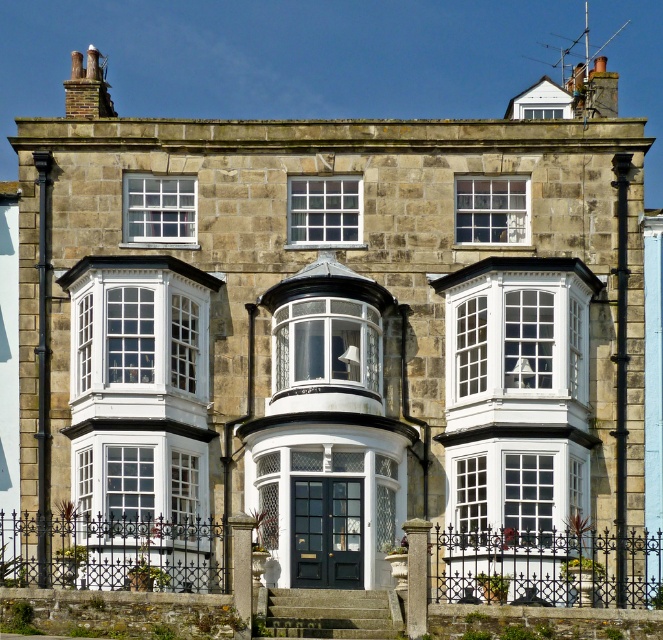
Which is below, clear glass bay window at center or clear glass window at upper center?

Positioned lower is clear glass bay window at center.

Identify the location of clear glass bay window at center. (326, 342).

What are the coordinates of `clear glass bay window at center` in the screenshot? It's located at (326, 342).

Does white glass window at upper left have a smaller size compared to white wood window at center?

Actually, white glass window at upper left might be larger than white wood window at center.

Is white glass window at upper left above white wood window at center?

Indeed, white glass window at upper left is positioned over white wood window at center.

This screenshot has height=640, width=663. Identify the location of white glass window at upper left. (158, 209).

I want to click on white glass window at upper left, so click(x=158, y=209).

Does white glass window at upper center have a lesser height compared to white glass window at upper left?

Incorrect, white glass window at upper center's height does not fall short of white glass window at upper left's.

Who is more forward, (x=324, y=227) or (x=158, y=211)?

Point (x=324, y=227) is in front.

Locate an element on the screen. The image size is (663, 640). white glass window at upper center is located at coordinates (324, 211).